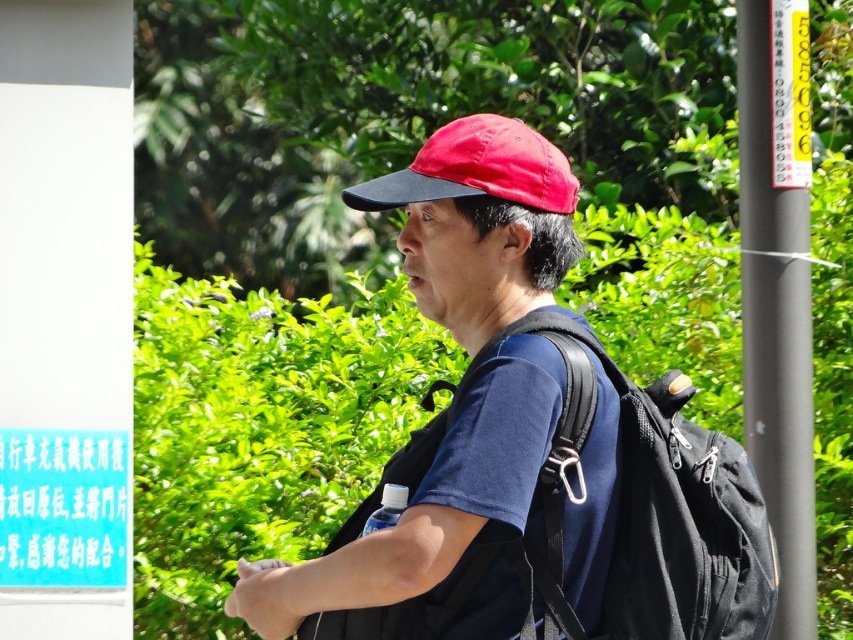
Does black matte pole at right come behind red fabric baseball cap at center?

Yes, it is behind red fabric baseball cap at center.

Can you confirm if black matte pole at right is positioned above red fabric baseball cap at center?

Incorrect, black matte pole at right is not positioned above red fabric baseball cap at center.

Between point (781, 176) and point (503, 120), which one is positioned behind?

Positioned behind is point (781, 176).

Identify the location of black matte pole at right. The width and height of the screenshot is (853, 640). (778, 291).

Can you confirm if black fabric backpack at center is positioned to the right of transparent plastic bottle at lower center?

Yes, black fabric backpack at center is to the right of transparent plastic bottle at lower center.

In the scene shown: Who is positioned more to the right, black fabric backpack at center or transparent plastic bottle at lower center?

black fabric backpack at center

Locate an element on the screen. This screenshot has width=853, height=640. black fabric backpack at center is located at coordinates (639, 522).

Image resolution: width=853 pixels, height=640 pixels. I want to click on matte blue shirt at center, so click(x=430, y=502).

Identify the location of matte blue shirt at center. The height and width of the screenshot is (640, 853). (430, 502).